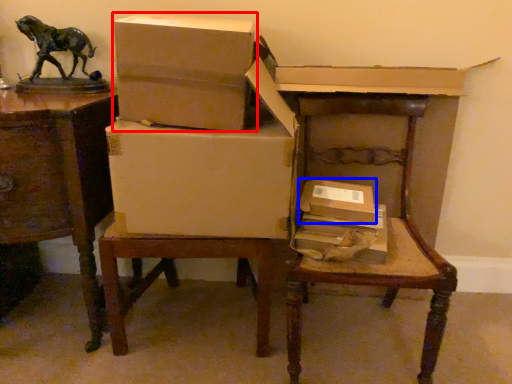
Question: Which point is further to the camera, box (highlighted by a red box) or box (highlighted by a blue box)?

Choices:
 (A) box
 (B) box

Answer: (B)